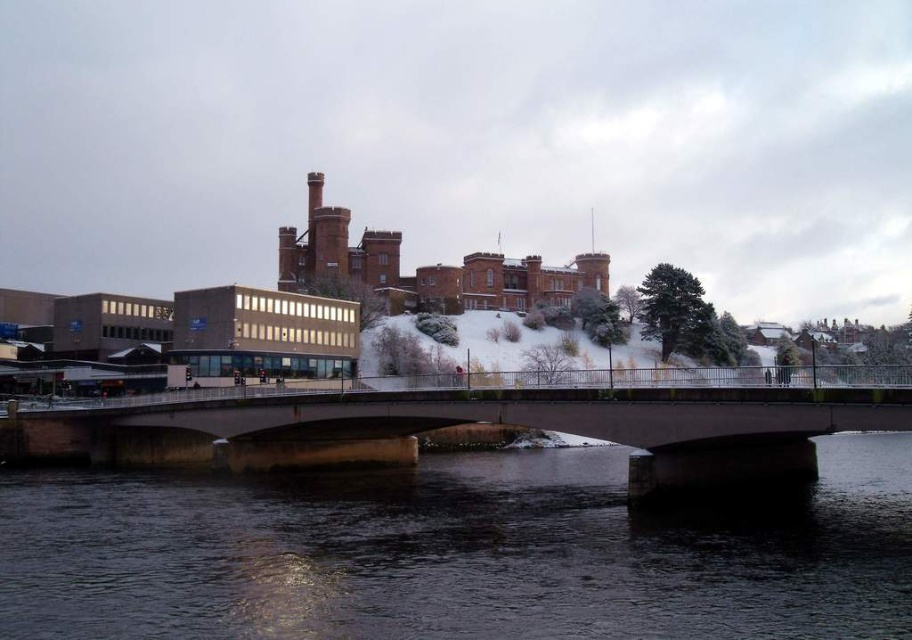
Is black water at center above concrete bridge at center?

No.

Which is below, black water at center or concrete bridge at center?

black water at center

Where is `black water at center`? This screenshot has width=912, height=640. black water at center is located at coordinates (456, 554).

Which is more to the right, concrete bridge at center or brown brick building at center?

brown brick building at center

Which is behind, point (349, 456) or point (499, 256)?

The point (499, 256) is more distant.

Locate an element on the screen. The image size is (912, 640). concrete bridge at center is located at coordinates coord(475,420).

Can you confirm if black water at center is bigger than brown brick building at center?

No.

Who is shorter, black water at center or brown brick building at center?

black water at center is shorter.

Does point (579, 449) lie in front of point (344, 232)?

That is True.

Locate an element on the screen. The width and height of the screenshot is (912, 640). black water at center is located at coordinates (456, 554).